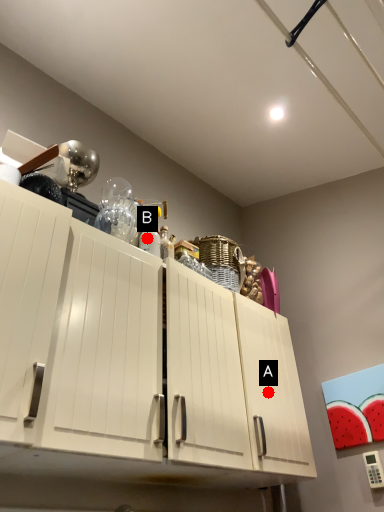
Question: Two points are circled on the image, labeled by A and B beside each circle. Which point is closer to the camera?

Choices:
 (A) A is closer
 (B) B is closer

Answer: (B)